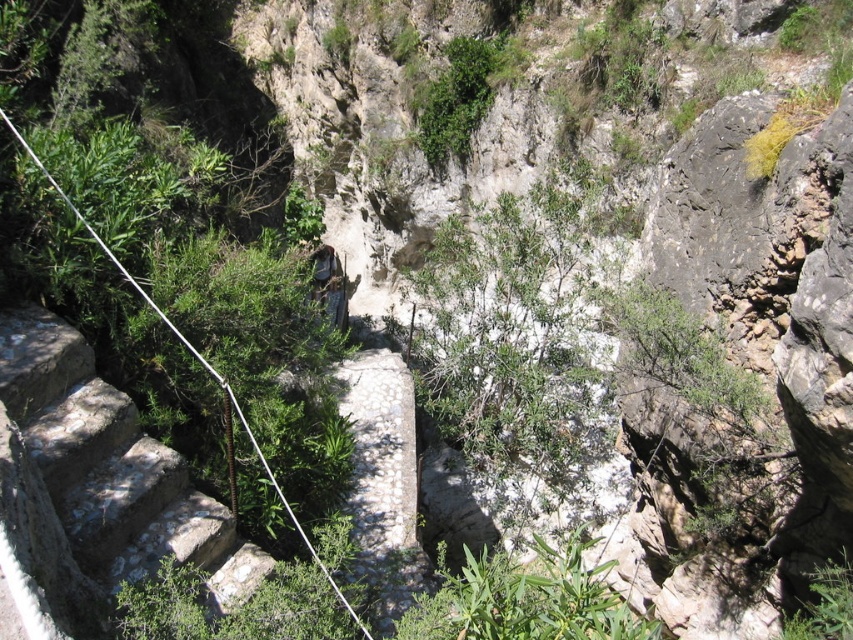
Between stone stairs at left and green leafy bush at upper center, which one appears on the left side from the viewer's perspective?

stone stairs at left

Where is `stone stairs at left`? stone stairs at left is located at coordinates (96, 483).

Who is more forward, (79,616) or (445,106)?

Point (79,616) is more forward.

Locate an element on the screen. The height and width of the screenshot is (640, 853). stone stairs at left is located at coordinates (96, 483).